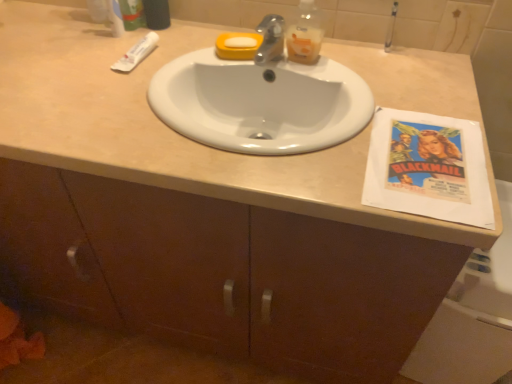
This screenshot has width=512, height=384. I want to click on free space in front of green matte toothpaste tube at upper left, so click(x=119, y=53).